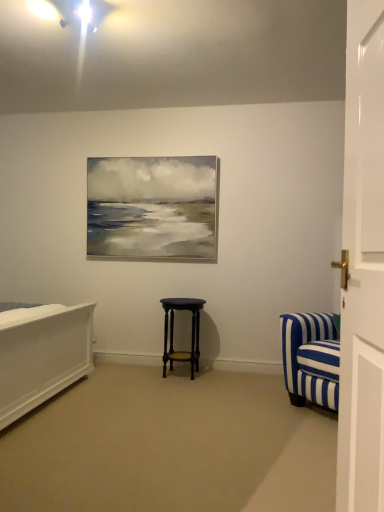
Question: Looking at their shapes, would you say white glossy door at right is wider or thinner than matte black stool at center?

Choices:
 (A) wide
 (B) thin

Answer: (B)

Question: Considering the positions of point (345, 504) and point (193, 340), is point (345, 504) closer or farther from the camera than point (193, 340)?

Choices:
 (A) farther
 (B) closer

Answer: (B)

Question: In terms of height, does white glossy door at right look taller or shorter compared to matte black stool at center?

Choices:
 (A) tall
 (B) short

Answer: (A)

Question: Would you say matte black stool at center is inside or outside white glossy door at right?

Choices:
 (A) inside
 (B) outside

Answer: (B)

Question: From their relative heights in the image, would you say matte black stool at center is taller or shorter than white glossy door at right?

Choices:
 (A) short
 (B) tall

Answer: (A)

Question: Considering their positions, is matte black stool at center located in front of or behind white glossy door at right?

Choices:
 (A) front
 (B) behind

Answer: (B)

Question: Considering the positions of matte black stool at center and white glossy door at right in the image, is matte black stool at center bigger or smaller than white glossy door at right?

Choices:
 (A) big
 (B) small

Answer: (A)